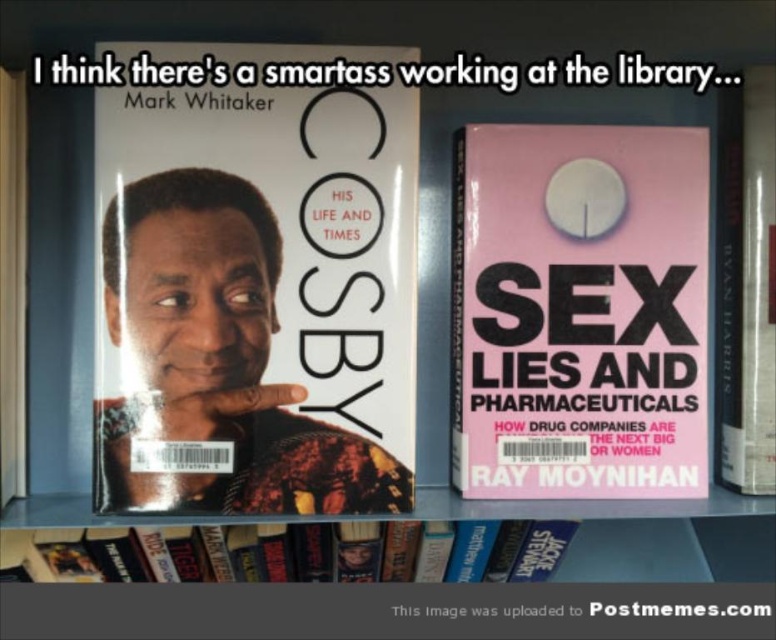
You are organizing a library and need to place the matte black book cover at center between two other books. Based on its position, which side of the bookshelf should you place it on?

The matte black book cover at center is located at point (255,280), so it should be placed on the left side of the bookshelf.

You are a photographer trying to capture the two points on the bookshelf. Which point, point (241, 257) or point (88, 552), will appear larger in your photo?

Point (241, 257) is closer to the camera than point (88, 552), so it will appear larger in the photo.